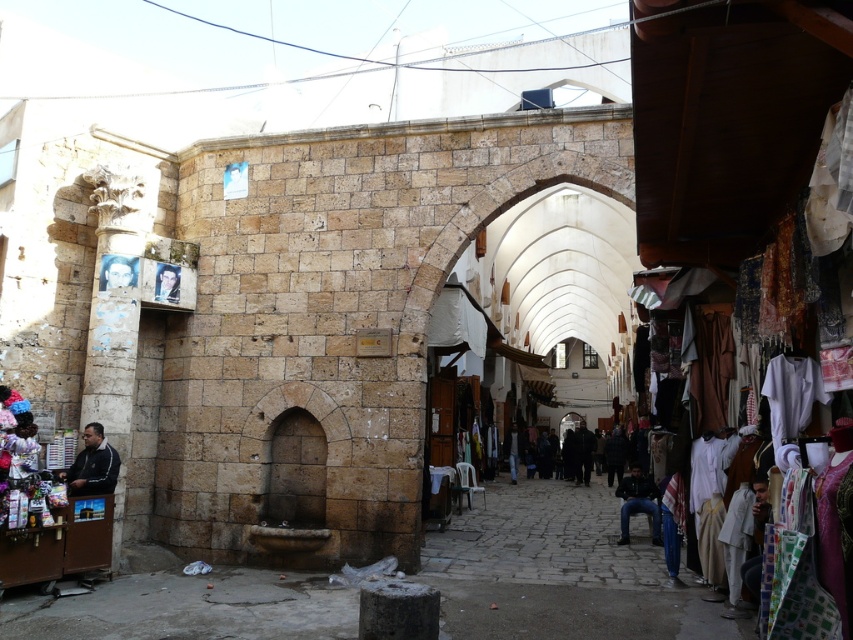
Question: Which object is farther from the camera taking this photo?

Choices:
 (A) dark gray fabric jacket at lower left
 (B) dark blue jeans at lower right

Answer: (B)

Question: Does dark gray fabric jacket at lower left appear on the left side of dark blue jeans at lower right?

Choices:
 (A) yes
 (B) no

Answer: (A)

Question: Which of the following is the farthest from the observer?

Choices:
 (A) dark gray fabric jacket at lower left
 (B) dark blue jeans at lower right

Answer: (B)

Question: Does dark gray fabric jacket at lower left appear on the left side of dark blue jeans at lower right?

Choices:
 (A) yes
 (B) no

Answer: (A)

Question: Can you confirm if dark gray fabric jacket at lower left is bigger than dark blue jeans at lower right?

Choices:
 (A) yes
 (B) no

Answer: (B)